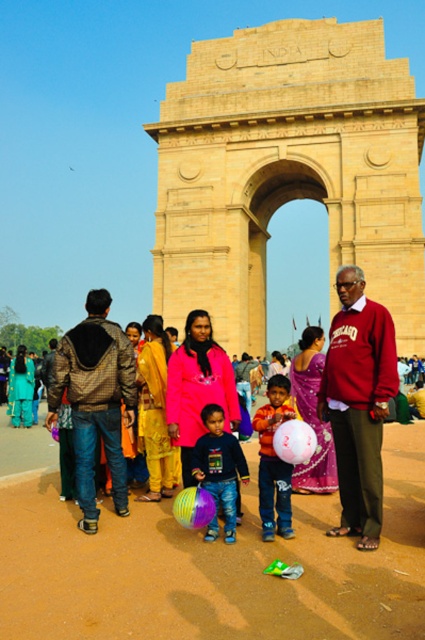
Can you confirm if multicolored plastic ball at center is positioned above white glossy balloon at center?

No, multicolored plastic ball at center is not above white glossy balloon at center.

Which is above, multicolored plastic ball at center or white glossy balloon at center?

white glossy balloon at center is above.

Image resolution: width=425 pixels, height=640 pixels. In order to click on multicolored plastic ball at center in this screenshot , I will do `click(220, 470)`.

What are the coordinates of `multicolored plastic ball at center` in the screenshot? It's located at (220, 470).

Describe the element at coordinates (274, 461) in the screenshot. This screenshot has width=425, height=640. I see `matte pink balloon at center` at that location.

Can you confirm if matte pink balloon at center is bigger than translucent multicolored balloon at center?

Indeed, matte pink balloon at center has a larger size compared to translucent multicolored balloon at center.

Identify the location of matte pink balloon at center. This screenshot has width=425, height=640. (274, 461).

Which is above, matte pink dress at center or white glossy balloon at center?

white glossy balloon at center

Does matte pink dress at center appear over white glossy balloon at center?

Incorrect, matte pink dress at center is not positioned above white glossy balloon at center.

Measure the distance between point (34,429) and camera.

Point (34,429) is 76.81 meters from camera.

Image resolution: width=425 pixels, height=640 pixels. In order to click on matte pink dress at center in this screenshot , I will do `click(25, 451)`.